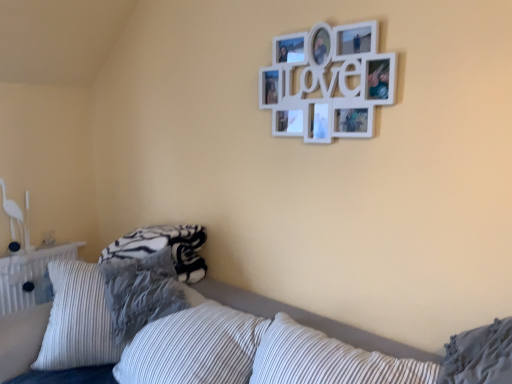
This screenshot has height=384, width=512. I want to click on textured gray pillow at lower left, acting as the second pillow starting from the right, so click(141, 292).

This screenshot has width=512, height=384. Describe the element at coordinates (248, 353) in the screenshot. I see `white striped pillow at lower center` at that location.

At what (x,y) coordinates should I click in order to perform the action: click on white striped pillow at lower right, marked as the second pillow in a left-to-right arrangement. Please return your answer as a coordinate pair (x, y). This screenshot has width=512, height=384. Looking at the image, I should click on (479, 355).

How much space does white striped pillow at lower right, marked as the second pillow in a left-to-right arrangement, occupy vertically?

white striped pillow at lower right, marked as the second pillow in a left-to-right arrangement, is 11.31 inches tall.

Locate an element on the screen. This screenshot has width=512, height=384. textured gray pillow at lower left, which is counted as the 2th pillow, starting from the front is located at coordinates (141, 292).

From the image's perspective, would you say white striped pillow at lower center is shown under textured gray pillow at lower left, which is counted as the 2th pillow, starting from the front?

Yes, from the image's perspective, white striped pillow at lower center is below textured gray pillow at lower left, which is counted as the 2th pillow, starting from the front.

Which object is positioned more to the right, white striped pillow at lower center or textured gray pillow at lower left, arranged as the first pillow when viewed from the back?

From the viewer's perspective, white striped pillow at lower center appears more on the right side.

Considering the sizes of white striped pillow at lower center and textured gray pillow at lower left, acting as the second pillow starting from the right, in the image, is white striped pillow at lower center bigger or smaller than textured gray pillow at lower left, acting as the second pillow starting from the right,?

Clearly, white striped pillow at lower center is larger in size than textured gray pillow at lower left, acting as the second pillow starting from the right.

From a real-world perspective, between white striped pillow at lower center and textured gray pillow at lower left, arranged as the first pillow when viewed from the back, who is vertically lower?

From a 3D spatial view, white striped pillow at lower center is below.

Would you say textured gray pillow at lower left, which ranks as the first pillow in left-to-right order, is outside white striped pillow at lower right, acting as the first pillow starting from the front?

Yes.

Is textured gray pillow at lower left, which is counted as the 2th pillow, starting from the front, next to white striped pillow at lower right, marked as the second pillow in a left-to-right arrangement, and touching it?

textured gray pillow at lower left, which is counted as the 2th pillow, starting from the front, and white striped pillow at lower right, marked as the second pillow in a left-to-right arrangement, are clearly separated.

From the image's perspective, between textured gray pillow at lower left, which is counted as the 2th pillow, starting from the front, and white striped pillow at lower right, marked as the second pillow in a left-to-right arrangement, which one is located above?

white striped pillow at lower right, marked as the second pillow in a left-to-right arrangement, appears higher in the image.

This screenshot has width=512, height=384. I want to click on pillow located on the right of textured gray pillow at lower left, acting as the second pillow starting from the right, so click(479, 355).

From the image's perspective, between white matte picture frame at upper center and white striped pillow at lower center, who is located below?

white striped pillow at lower center appears lower in the image.

Choose the correct answer: Is white matte picture frame at upper center inside white striped pillow at lower center or outside it?

The correct answer is: outside.

Based on their sizes in the image, would you say white matte picture frame at upper center is bigger or smaller than white striped pillow at lower center?

Considering their sizes, white matte picture frame at upper center takes up less space than white striped pillow at lower center.

Measure the distance between white striped pillow at lower center and white matte picture frame at upper center.

They are 37.01 inches apart.

In the image, is white striped pillow at lower center positioned in front of or behind white matte picture frame at upper center?

Clearly, white striped pillow at lower center is in front of white matte picture frame at upper center.

Do you think white striped pillow at lower center is within white matte picture frame at upper center, or outside of it?

white striped pillow at lower center is not inside white matte picture frame at upper center, it's outside.

In terms of width, does white striped pillow at lower center look wider or thinner when compared to white matte picture frame at upper center?

Considering their sizes, white striped pillow at lower center looks broader than white matte picture frame at upper center.

Is textured gray pillow at lower left, which is counted as the 2th pillow, starting from the front, oriented away from white matte picture frame at upper center?

No, textured gray pillow at lower left, which is counted as the 2th pillow, starting from the front, is not facing away from white matte picture frame at upper center.

Is textured gray pillow at lower left, which is counted as the 2th pillow, starting from the front, positioned in front of white matte picture frame at upper center?

No, it is behind white matte picture frame at upper center.

Considering the points (105, 297) and (388, 65), which point is behind, point (105, 297) or point (388, 65)?

Positioned behind is point (105, 297).

Looking at the image, does textured gray pillow at lower left, arranged as the first pillow when viewed from the back, seem bigger or smaller compared to white striped pillow at lower center?

Considering their sizes, textured gray pillow at lower left, arranged as the first pillow when viewed from the back, takes up less space than white striped pillow at lower center.

Is textured gray pillow at lower left, which ranks as the first pillow in left-to-right order, not inside white striped pillow at lower center?

Actually, textured gray pillow at lower left, which ranks as the first pillow in left-to-right order, is at least partially inside white striped pillow at lower center.

Does textured gray pillow at lower left, which is counted as the 2th pillow, starting from the front, come behind white striped pillow at lower center?

That is True.

There is a white striped pillow at lower center. In order to click on the 1st pillow above it (from the image's perspective) in this screenshot , I will do `click(141, 292)`.

Does white striped pillow at lower right, marked as the second pillow in a left-to-right arrangement, have a lesser height compared to textured gray pillow at lower left, arranged as the first pillow when viewed from the back?

Yes.

Based on the photo, would you say white striped pillow at lower right, marked as the second pillow in a left-to-right arrangement, is a long distance from textured gray pillow at lower left, which is counted as the 2th pillow, starting from the front?

Indeed, white striped pillow at lower right, marked as the second pillow in a left-to-right arrangement, is not near textured gray pillow at lower left, which is counted as the 2th pillow, starting from the front.

Is white striped pillow at lower right, acting as the first pillow starting from the front, inside the boundaries of textured gray pillow at lower left, which ranks as the first pillow in left-to-right order, or outside?

white striped pillow at lower right, acting as the first pillow starting from the front, lies outside textured gray pillow at lower left, which ranks as the first pillow in left-to-right order.

Where is `pillow on the left of the white striped pillow at lower center`? The image size is (512, 384). pillow on the left of the white striped pillow at lower center is located at coordinates (141, 292).

What are the coordinates of `pillow behind the white striped pillow at lower right, the second pillow in the back-to-front sequence` in the screenshot? It's located at [141, 292].

Looking at the image, which one is located closer to white striped pillow at lower right, the second pillow in the back-to-front sequence, white matte picture frame at upper center or textured gray pillow at lower left, which ranks as the first pillow in left-to-right order?

The object closer to white striped pillow at lower right, the second pillow in the back-to-front sequence, is white matte picture frame at upper center.

Estimate the real-world distances between objects in this image. Which object is further from white striped pillow at lower center, white matte picture frame at upper center or textured gray pillow at lower left, arranged as the first pillow when viewed from the back?

Among the two, white matte picture frame at upper center is located further to white striped pillow at lower center.

Which object lies further to the anchor point white matte picture frame at upper center, white striped pillow at lower center or white striped pillow at lower right, arranged as the first pillow when viewed from the right?

white striped pillow at lower right, arranged as the first pillow when viewed from the right, is positioned further to the anchor white matte picture frame at upper center.

Looking at this image, based on their spatial positions, is textured gray pillow at lower left, which ranks as the first pillow in left-to-right order, or white matte picture frame at upper center further from white striped pillow at lower center?

white matte picture frame at upper center lies further to white striped pillow at lower center than the other object.

Looking at the image, which one is located closer to white striped pillow at lower center, white striped pillow at lower right, arranged as the first pillow when viewed from the right, or textured gray pillow at lower left, which ranks as the first pillow in left-to-right order?

Among the two, textured gray pillow at lower left, which ranks as the first pillow in left-to-right order, is located nearer to white striped pillow at lower center.

Looking at the image, which one is located further to white striped pillow at lower right, arranged as the first pillow when viewed from the right, textured gray pillow at lower left, which ranks as the first pillow in left-to-right order, or white striped pillow at lower center?

Based on the image, textured gray pillow at lower left, which ranks as the first pillow in left-to-right order, appears to be further to white striped pillow at lower right, arranged as the first pillow when viewed from the right.

Looking at the image, which one is located closer to white matte picture frame at upper center, white striped pillow at lower right, arranged as the first pillow when viewed from the right, or textured gray pillow at lower left, arranged as the first pillow when viewed from the back?

white striped pillow at lower right, arranged as the first pillow when viewed from the right, is closer to white matte picture frame at upper center.

Looking at the image, which one is located further to textured gray pillow at lower left, which ranks as the first pillow in left-to-right order, white striped pillow at lower center or white striped pillow at lower right, acting as the first pillow starting from the front?

Based on the image, white striped pillow at lower right, acting as the first pillow starting from the front, appears to be further to textured gray pillow at lower left, which ranks as the first pillow in left-to-right order.

This screenshot has height=384, width=512. I want to click on picture frame between textured gray pillow at lower left, which is counted as the 2th pillow, starting from the front, and white striped pillow at lower right, marked as the second pillow in a left-to-right arrangement, from left to right, so click(328, 82).

This screenshot has height=384, width=512. What are the coordinates of `bed located between textured gray pillow at lower left, which is counted as the 2th pillow, starting from the front, and white striped pillow at lower right, the second pillow in the back-to-front sequence, in the left-right direction` in the screenshot? It's located at (248, 353).